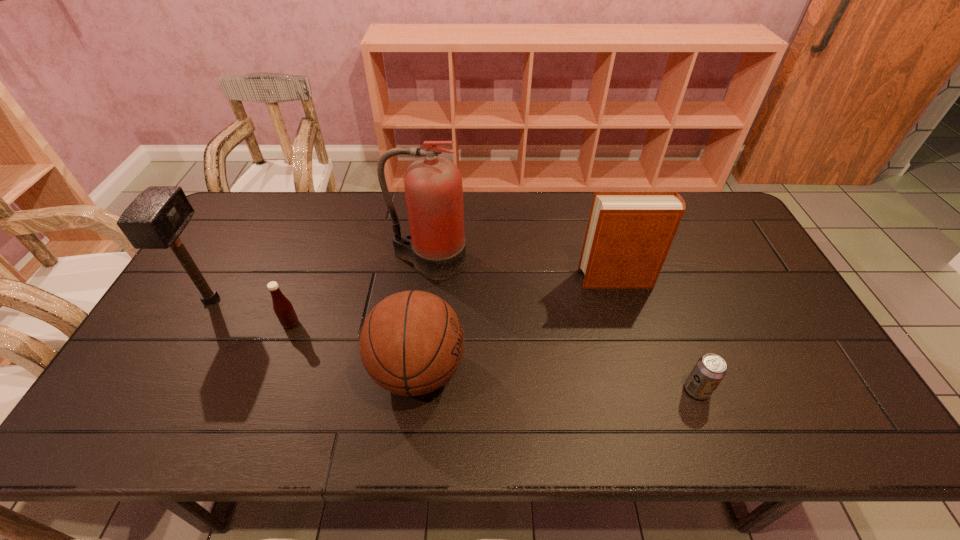
Locate an element on the screen. The image size is (960, 540). free spot between the basketball and the hardback book is located at coordinates (517, 325).

Where is `empty space between the basketball and the leftmost object`? Image resolution: width=960 pixels, height=540 pixels. empty space between the basketball and the leftmost object is located at coordinates (315, 335).

Where is `object that is the fourth nearest to the shortest object`? object that is the fourth nearest to the shortest object is located at coordinates (282, 307).

The width and height of the screenshot is (960, 540). What are the coordinates of `the fifth closest object to the Tabasco sauce` in the screenshot? It's located at (710, 369).

I want to click on vacant space that satisfies the following two spatial constraints: 1. on the side with brand label of the basketball; 2. on the left side of the shortest object, so click(x=416, y=390).

Where is `blank space that satisfies the following two spatial constraints: 1. at the nozzle of the tallest object; 2. on the left side of the beer can`? This screenshot has width=960, height=540. blank space that satisfies the following two spatial constraints: 1. at the nozzle of the tallest object; 2. on the left side of the beer can is located at coordinates [x=414, y=390].

Where is `vacant position in the image that satisfies the following two spatial constraints: 1. on the open cover of the hardback book; 2. on the front side of the fifth tallest object`? vacant position in the image that satisfies the following two spatial constraints: 1. on the open cover of the hardback book; 2. on the front side of the fifth tallest object is located at coordinates (630, 324).